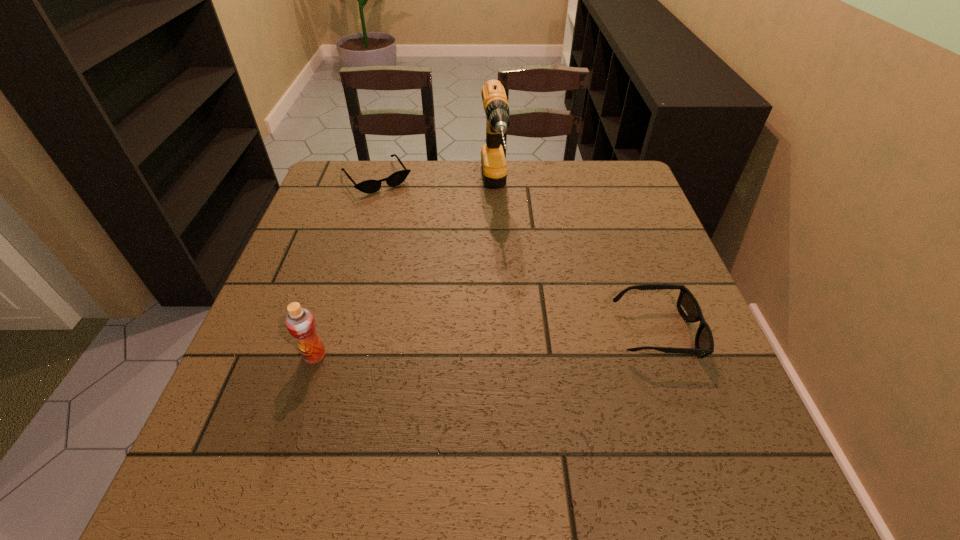
This screenshot has width=960, height=540. Find the location of `free space at the far edge of the desktop`. free space at the far edge of the desktop is located at coordinates pyautogui.click(x=466, y=196).

The width and height of the screenshot is (960, 540). I want to click on blank area at the near edge, so click(x=483, y=402).

I want to click on vacant space at the left edge of the desktop, so click(299, 240).

Find the location of a particular element. vacant space at the right edge of the desktop is located at coordinates (644, 355).

You are a GUI agent. You are given a task and a screenshot of the screen. Output one action in this format:
    pyautogui.click(x=<x>, y=<y>)
    Task: Click on the free region at the far left corner
    
    Given the screenshot: What is the action you would take?
    pyautogui.click(x=366, y=170)

You are a GUI agent. You are given a task and a screenshot of the screen. Output one action in this format:
    pyautogui.click(x=<x>, y=<y>)
    Task: Click on the vacant space at the far right corner of the desktop
    
    Given the screenshot: What is the action you would take?
    pyautogui.click(x=622, y=188)

Locate an element on the screen. This screenshot has height=540, width=960. vacant area at the near right corner of the desktop is located at coordinates (731, 390).

At what (x,y) coordinates should I click in order to perform the action: click on vacant space in between the third shortest object and the shortest object. Please return your answer as a coordinate pair (x, y). Looking at the image, I should click on (346, 267).

Where is `vacant region between the drill and the orange juice`? vacant region between the drill and the orange juice is located at coordinates (404, 274).

The image size is (960, 540). In order to click on free spot between the farther sunglasses and the orange juice in this screenshot , I will do `click(346, 267)`.